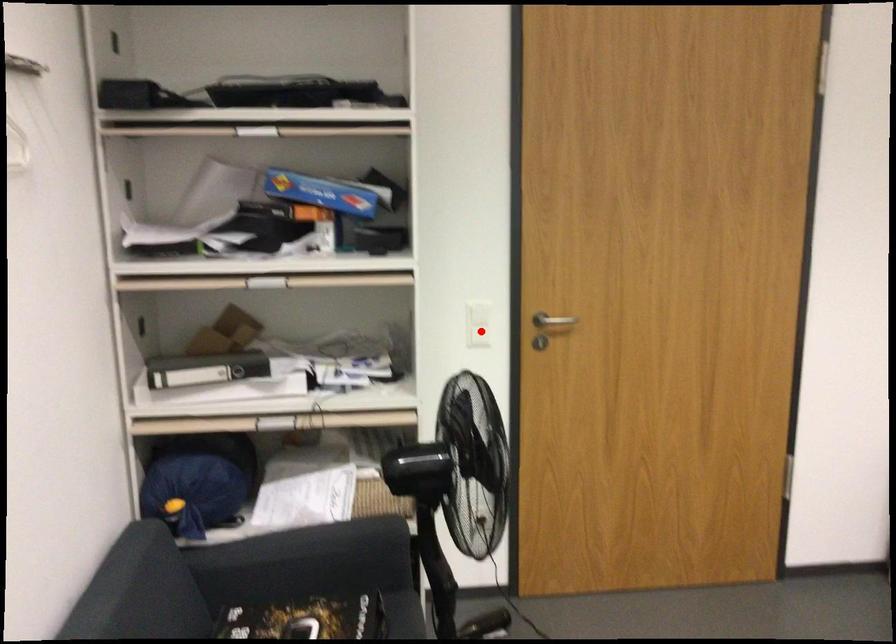
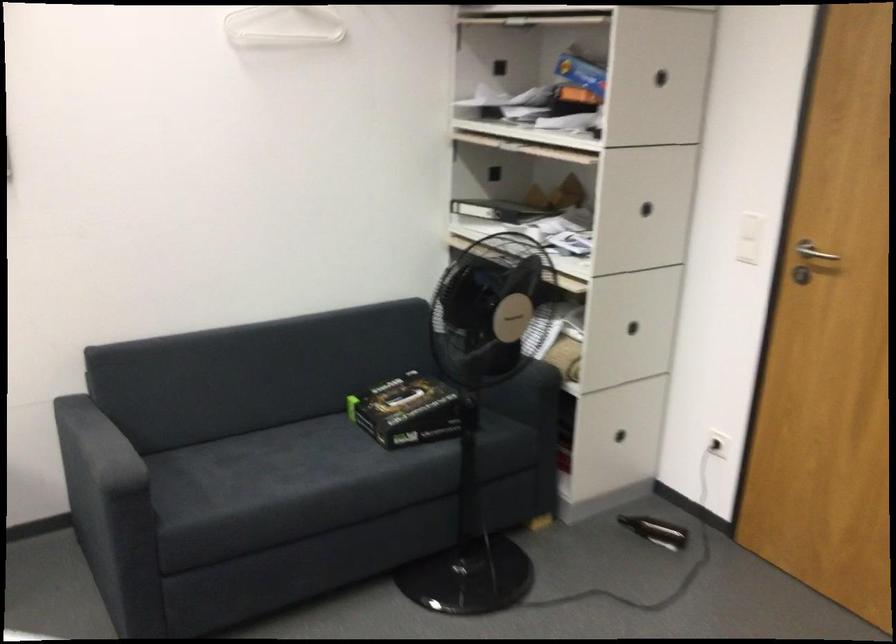
Locate, in the second image, the point that corresponds to the highlighted location in the first image.

(748, 238)